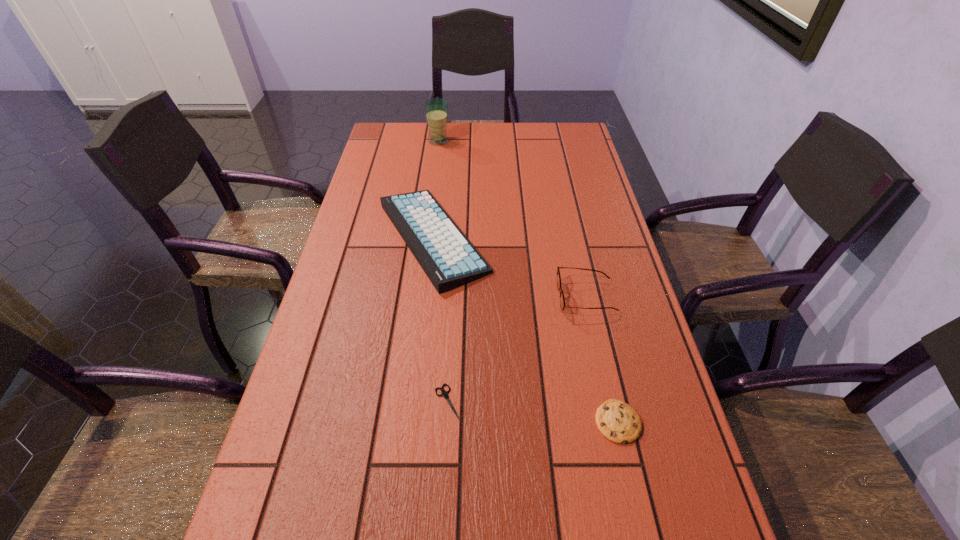
Locate an element on the screen. The width and height of the screenshot is (960, 540). the tallest object is located at coordinates (436, 109).

This screenshot has height=540, width=960. I want to click on the farthest object, so click(436, 109).

You are a GUI agent. You are given a task and a screenshot of the screen. Output one action in this format:
    pyautogui.click(x=<x>, y=<y>)
    Task: Click on the spectacles
    The image size is (960, 540).
    Given the screenshot: What is the action you would take?
    pyautogui.click(x=562, y=300)

Where is `computer keyboard`? This screenshot has width=960, height=540. computer keyboard is located at coordinates (448, 258).

Identify the location of cookie. (617, 421).

This screenshot has height=540, width=960. I want to click on shears, so click(444, 393).

The height and width of the screenshot is (540, 960). Identify the location of vacant area situated on the front of the farthest object. (436, 165).

Locate an element on the screen. This screenshot has width=960, height=540. free space located 0.330m on the face of the spectacles is located at coordinates (426, 297).

Find the location of `vacant area situated 0.370m on the face of the spectacles`. vacant area situated 0.370m on the face of the spectacles is located at coordinates point(410,297).

Find the location of a particular element. The image size is (960, 540). vacant space situated 0.100m on the face of the spectacles is located at coordinates (518, 297).